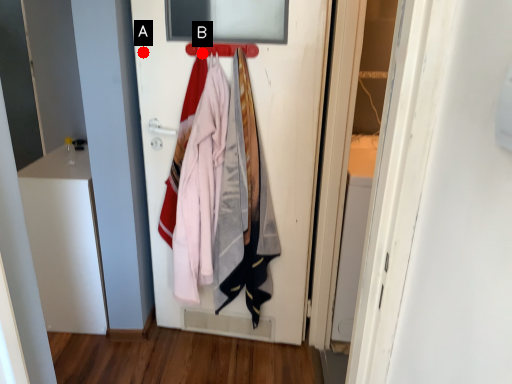
Question: Two points are circled on the image, labeled by A and B beside each circle. Which of the following is the closest to the observer?

Choices:
 (A) A is closer
 (B) B is closer

Answer: (B)